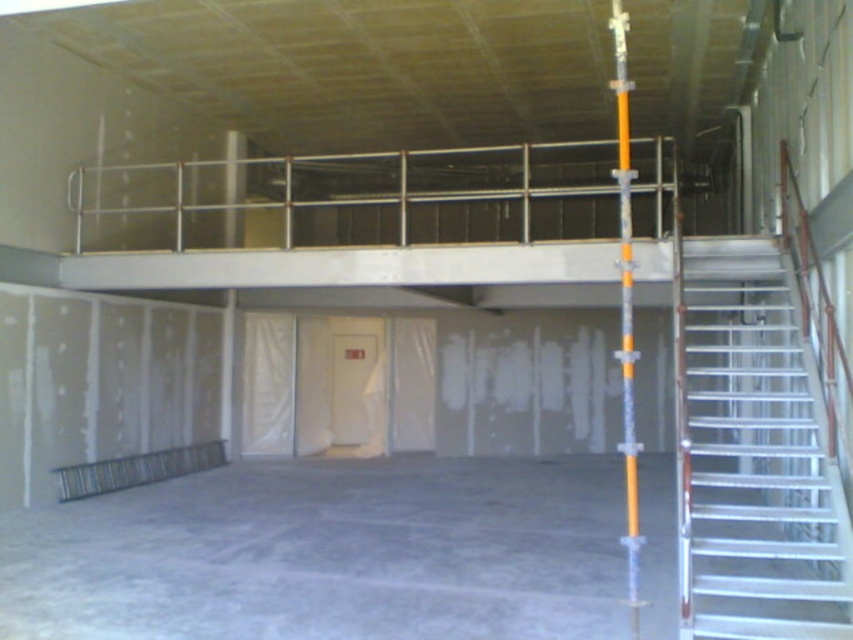
Question: Which object is farther from the camera taking this photo?

Choices:
 (A) metallic silver staircase at right
 (B) orange metallic pole at right
 (C) metallic silver balustrade at lower left

Answer: (C)

Question: Where is metallic silver staircase at right located in relation to orange metallic pole at right in the image?

Choices:
 (A) above
 (B) below

Answer: (B)

Question: Where is orange metallic pole at right located in relation to metallic silver balustrade at lower left in the image?

Choices:
 (A) above
 (B) below

Answer: (A)

Question: Which of the following is the closest to the observer?

Choices:
 (A) (750, 396)
 (B) (634, 534)
 (C) (143, 461)

Answer: (B)

Question: Which of the following is the closest to the observer?

Choices:
 (A) orange metallic pole at right
 (B) metallic silver staircase at right
 (C) metallic silver balustrade at lower left

Answer: (B)

Question: Can you confirm if metallic silver staircase at right is smaller than orange metallic pole at right?

Choices:
 (A) yes
 (B) no

Answer: (A)